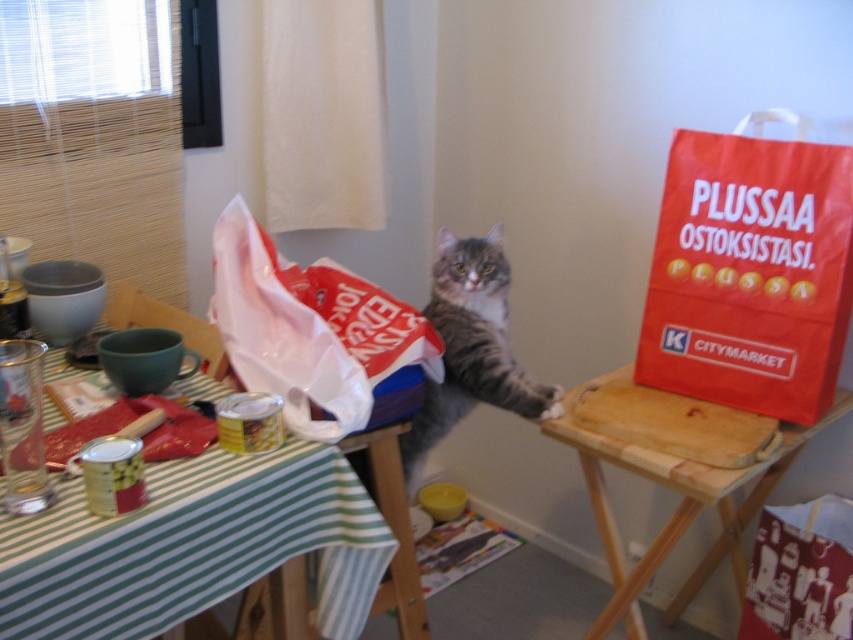
Question: Estimate the real-world distances between objects in this image. Which object is farther from the green striped fabric at lower left?

Choices:
 (A) tabby fur cat at center
 (B) red paper bag at upper right
 (C) wooden cutting board at upper right

Answer: (B)

Question: Which object is the closest to the red paper bag at upper right?

Choices:
 (A) green striped fabric at lower left
 (B) wooden cutting board at upper right
 (C) white plastic bag at center
 (D) tabby fur cat at center

Answer: (B)

Question: Is the position of red paper bag at upper right less distant than that of tabby fur cat at center?

Choices:
 (A) yes
 (B) no

Answer: (A)

Question: Which object appears farthest from the camera in this image?

Choices:
 (A) wooden cutting board at upper right
 (B) tabby fur cat at center
 (C) white plastic bag at center

Answer: (B)

Question: Is white plastic bag at center in front of wooden cutting board at upper right?

Choices:
 (A) yes
 (B) no

Answer: (A)

Question: Is white plastic bag at center above tabby fur cat at center?

Choices:
 (A) yes
 (B) no

Answer: (A)